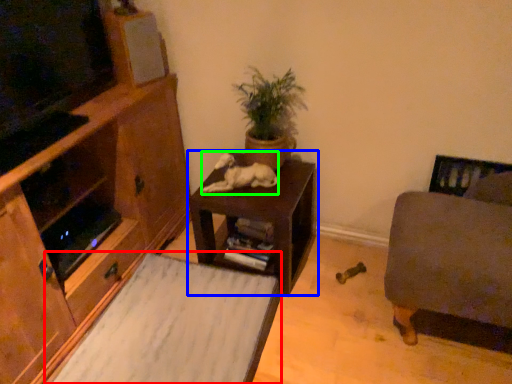
Question: Which is nearer to the plain (highlighted by a red box)? table (highlighted by a blue box) or animal (highlighted by a green box).

Choices:
 (A) table
 (B) animal

Answer: (A)